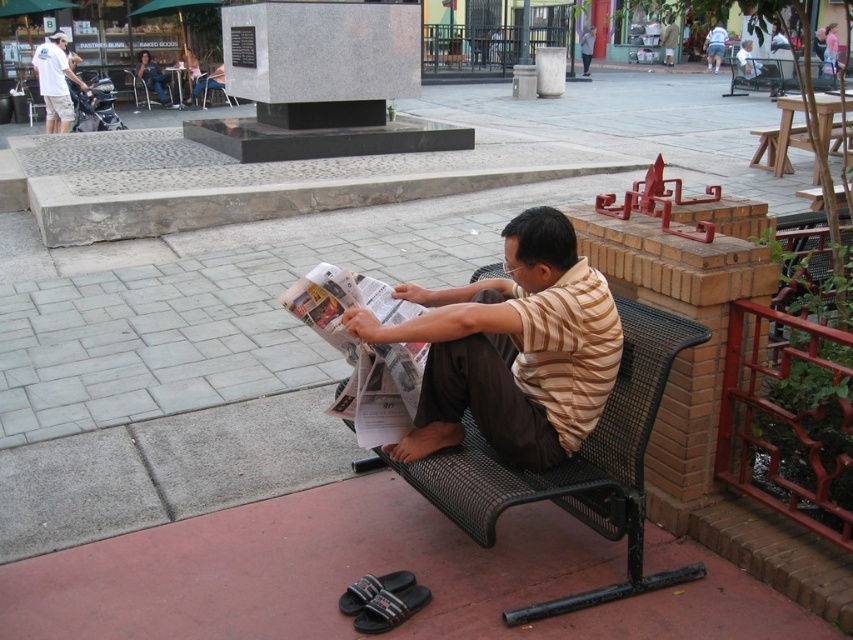
Based on the photo, you are a maintenance worker needing to reach both the black mesh park bench at center and the denim shorts at lower right. Given that your equipment can cover up to 100 feet in a single trip, can you manage to service both without needing to return to your vehicle?

The distance between the black mesh park bench at center and the denim shorts at lower right is 83.40 feet, which is within the 100 feet coverage of your equipment. Therefore, you can service both without returning to your vehicle.